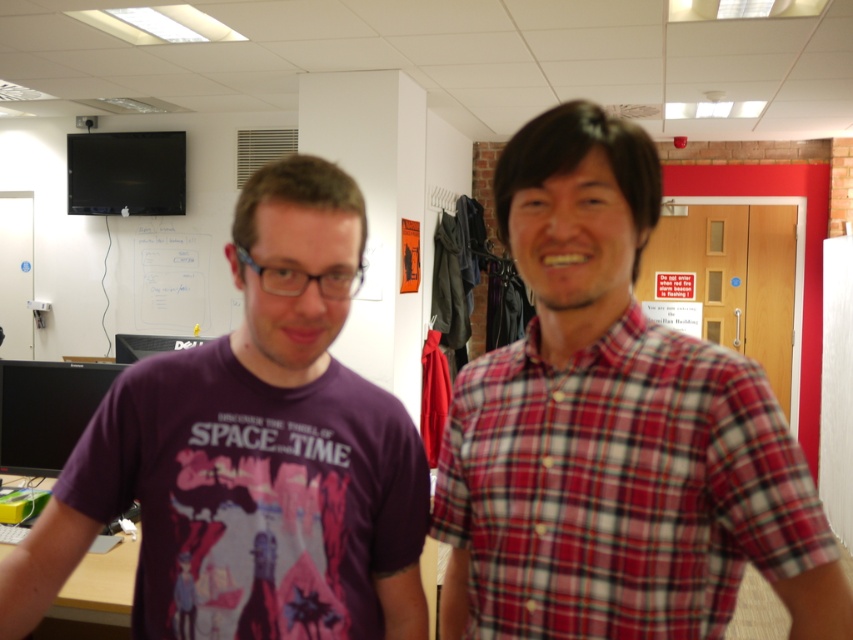
Is point (85, 538) positioned before point (572, 433)?

No.

Describe the element at coordinates (252, 452) in the screenshot. I see `purple cotton t-shirt at center` at that location.

I want to click on purple cotton t-shirt at center, so click(x=252, y=452).